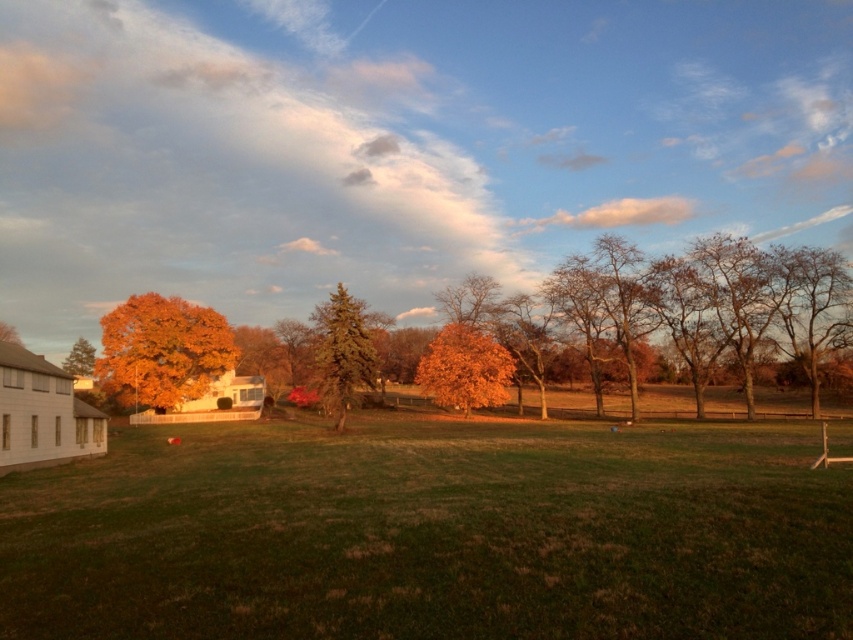
Measure the distance between orange leafy tree at left and camera.

A distance of 84.77 meters exists between orange leafy tree at left and camera.

Which is behind, point (166, 355) or point (79, 340)?

The point (79, 340) is more distant.

What are the coordinates of `orange leafy tree at left` in the screenshot? It's located at (161, 349).

From the picture: Which of these two, orange leafy tree at center or green textured tree at center, stands shorter?

Standing shorter between the two is orange leafy tree at center.

Who is more distant from viewer, (462, 408) or (314, 355)?

The point (314, 355) is behind.

The image size is (853, 640). In order to click on orange leafy tree at center in this screenshot , I will do `click(463, 369)`.

The image size is (853, 640). I want to click on orange leafy tree at center, so click(x=463, y=369).

Who is positioned more to the right, orange leafy tree at center or orange matte tree at left?

orange leafy tree at center

Who is more distant from viewer, (444,346) or (4,324)?

The point (4,324) is more distant.

Is point (462, 353) farther from camera compared to point (3, 323)?

No, (462, 353) is in front of (3, 323).

I want to click on orange leafy tree at center, so pos(463,369).